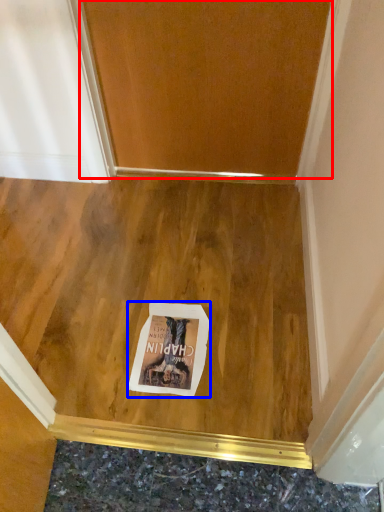
Question: Which object appears closest to the camera in this image, door (highlighted by a red box) or postcard (highlighted by a blue box)?

Choices:
 (A) door
 (B) postcard

Answer: (B)